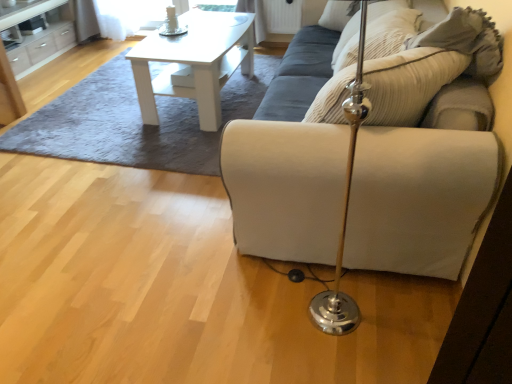
Question: Considering the relative sizes of white matte table at upper center and suede beige pillow at upper right, arranged as the 1th pillow when viewed from the front, in the image provided, is white matte table at upper center smaller than suede beige pillow at upper right, arranged as the 1th pillow when viewed from the front,?

Choices:
 (A) no
 (B) yes

Answer: (A)

Question: Could you tell me if white matte table at upper center is facing suede beige pillow at upper right, which is counted as the 2th pillow, starting from the back?

Choices:
 (A) yes
 (B) no

Answer: (B)

Question: From the image's perspective, is white matte table at upper center beneath suede beige pillow at upper right, which is counted as the 2th pillow, starting from the back?

Choices:
 (A) yes
 (B) no

Answer: (A)

Question: Does white matte table at upper center lie in front of suede beige pillow at upper right, arranged as the 1th pillow when viewed from the front?

Choices:
 (A) yes
 (B) no

Answer: (A)

Question: Does white matte table at upper center have a greater height compared to suede beige pillow at upper right, which is counted as the 2th pillow, starting from the back?

Choices:
 (A) yes
 (B) no

Answer: (A)

Question: Is point (165, 44) closer or farther from the camera than point (426, 205)?

Choices:
 (A) closer
 (B) farther

Answer: (B)

Question: Based on their positions, is white matte table at upper center located to the left or right of beige fabric couch at center?

Choices:
 (A) left
 (B) right

Answer: (A)

Question: Is white matte table at upper center wider or thinner than beige fabric couch at center?

Choices:
 (A) wide
 (B) thin

Answer: (B)

Question: Based on their sizes in the image, would you say white matte table at upper center is bigger or smaller than beige fabric couch at center?

Choices:
 (A) big
 (B) small

Answer: (B)

Question: From the image's perspective, is beige corduroy pillow at upper right, placed as the second pillow when sorted from front to back, above or below beige fabric couch at center?

Choices:
 (A) above
 (B) below

Answer: (A)

Question: From their relative heights in the image, would you say beige corduroy pillow at upper right, placed as the second pillow when sorted from front to back, is taller or shorter than beige fabric couch at center?

Choices:
 (A) tall
 (B) short

Answer: (B)

Question: Considering their positions, is beige corduroy pillow at upper right, placed as the second pillow when sorted from front to back, located in front of or behind beige fabric couch at center?

Choices:
 (A) behind
 (B) front

Answer: (A)

Question: Would you say beige corduroy pillow at upper right, placed as the second pillow when sorted from front to back, is to the left or to the right of beige fabric couch at center in the picture?

Choices:
 (A) right
 (B) left

Answer: (A)

Question: Does point (379, 48) appear closer or farther from the camera than point (199, 46)?

Choices:
 (A) farther
 (B) closer

Answer: (B)

Question: Looking at their shapes, would you say beige corduroy pillow at upper right, placed as the second pillow when sorted from front to back, is wider or thinner than white matte table at upper center?

Choices:
 (A) thin
 (B) wide

Answer: (A)